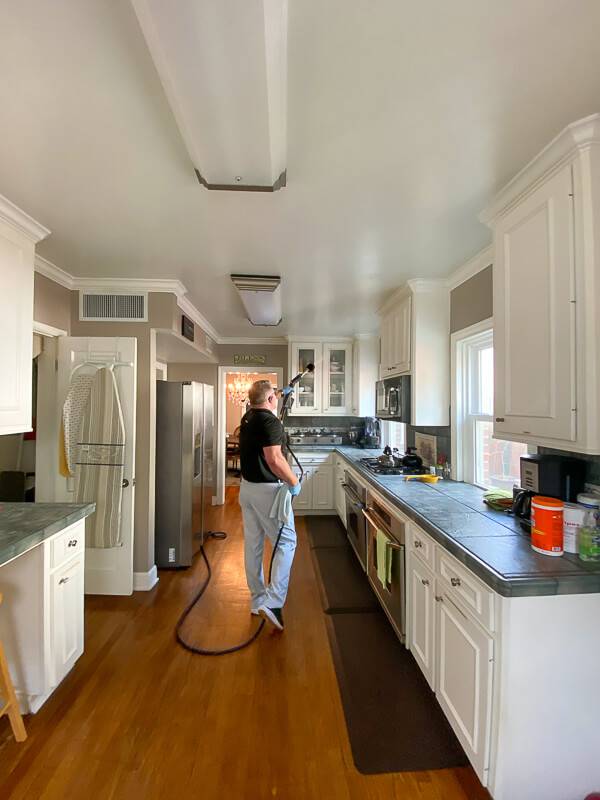
Where is `stool leg at kitchen desk`? stool leg at kitchen desk is located at coordinates (12, 700).